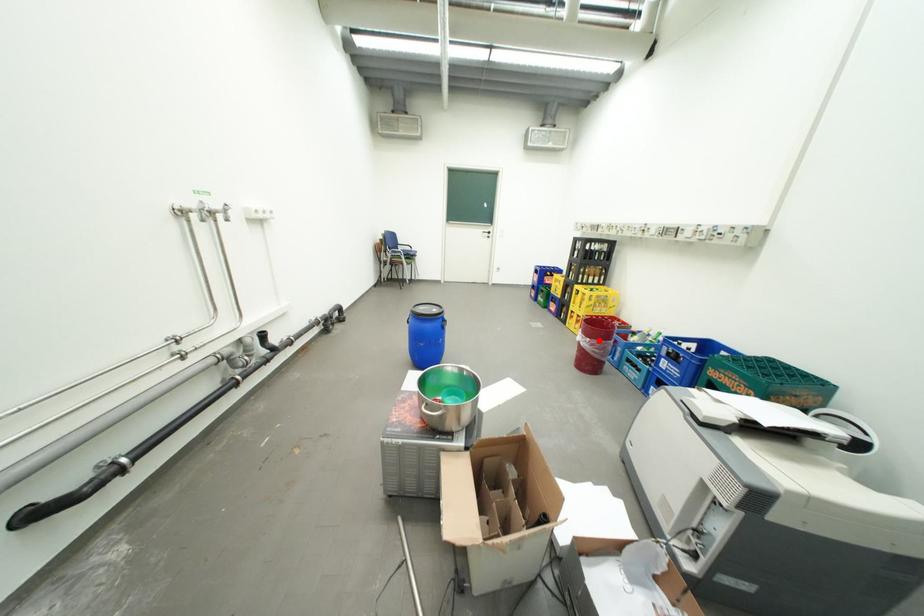
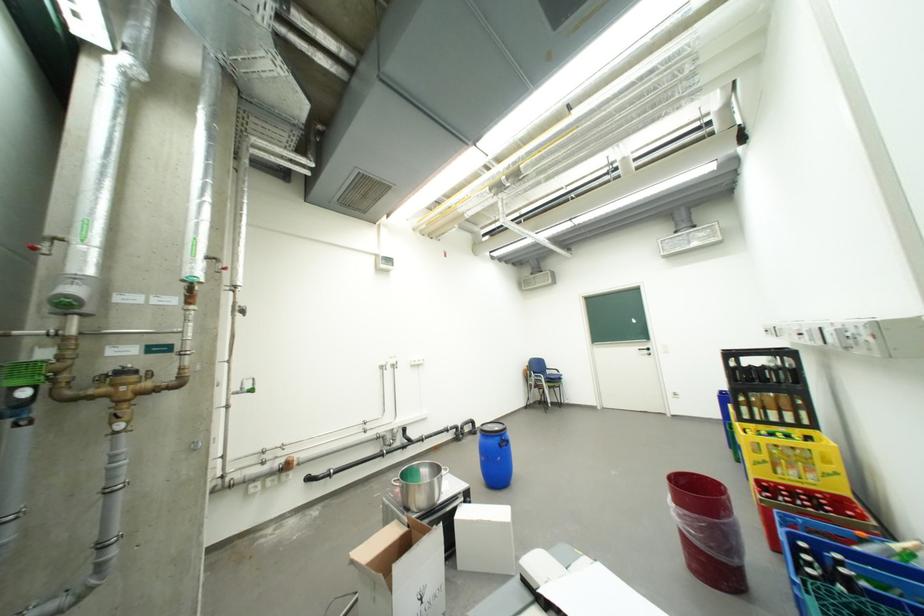
Question: I am providing you with two images of the same scene from different viewpoints. Given a red point in image1, look at the same physical point in image2. Is it:

Choices:
 (A) Closer to the viewpoint
 (B) Farther from the viewpoint

Answer: (B)